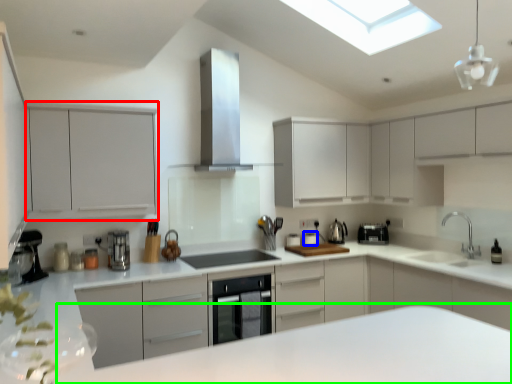
Question: Estimate the real-world distances between objects in this image. Which object is closer to cabinetry (highlighted by a red box), appliance (highlighted by a blue box) or counter (highlighted by a green box)?

Choices:
 (A) appliance
 (B) counter

Answer: (A)